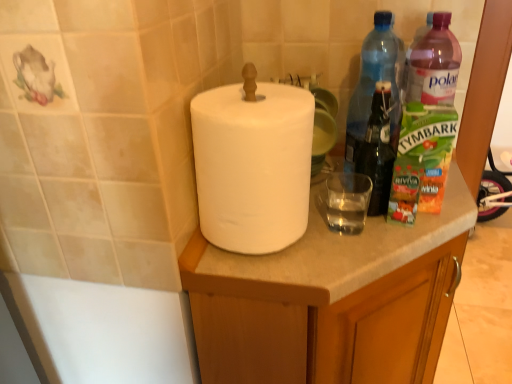
This screenshot has width=512, height=384. Describe the element at coordinates (330, 300) in the screenshot. I see `white matte cabinet at center` at that location.

Image resolution: width=512 pixels, height=384 pixels. What do you see at coordinates (253, 164) in the screenshot?
I see `white matte paper towel at center` at bounding box center [253, 164].

Looking at this image, measure the distance between point [397,55] and camera.

Point [397,55] is 33.43 inches away from camera.

This screenshot has height=384, width=512. Find the location of `white matte cabinet at center`. white matte cabinet at center is located at coordinates (330, 300).

Is transparent plastic bottle at upper right, the second bottle in the right-to-left sequence, next to white matte cabinet at center and touching it?

No, transparent plastic bottle at upper right, the second bottle in the right-to-left sequence, is not touching white matte cabinet at center.

Is transparent plastic bottle at upper right, the second bottle in the right-to-left sequence, positioned with its back to white matte cabinet at center?

No, white matte cabinet at center is not at the back of transparent plastic bottle at upper right, the second bottle in the right-to-left sequence.

Measure the distance from transparent plastic bottle at upper right, the second bottle in the right-to-left sequence, to white matte cabinet at center.

transparent plastic bottle at upper right, the second bottle in the right-to-left sequence, is 8.82 inches from white matte cabinet at center.

Does point (396, 72) appear closer or farther from the camera than point (352, 335)?

Clearly, point (396, 72) is more distant from the camera than point (352, 335).

Is pink plastic bottle at right, which ranks as the 2th bottle in left-to-right order, smaller than transparent plastic bottle at upper right, arranged as the 1th bottle when viewed from the left?

Incorrect, pink plastic bottle at right, which ranks as the 2th bottle in left-to-right order, is not smaller in size than transparent plastic bottle at upper right, arranged as the 1th bottle when viewed from the left.

In the image, is pink plastic bottle at right, which ranks as the 2th bottle in left-to-right order, positioned in front of or behind transparent plastic bottle at upper right, arranged as the 1th bottle when viewed from the left?

Visually, pink plastic bottle at right, which ranks as the 2th bottle in left-to-right order, is located in front of transparent plastic bottle at upper right, arranged as the 1th bottle when viewed from the left.

Can you confirm if pink plastic bottle at right, arranged as the first bottle when viewed from the right, is positioned to the left of transparent plastic bottle at upper right, the second bottle in the right-to-left sequence?

In fact, pink plastic bottle at right, arranged as the first bottle when viewed from the right, is to the right of transparent plastic bottle at upper right, the second bottle in the right-to-left sequence.

In terms of height, does transparent glass at center look taller or shorter compared to pink plastic bottle at right, which ranks as the 2th bottle in left-to-right order?

Considering their sizes, transparent glass at center has less height than pink plastic bottle at right, which ranks as the 2th bottle in left-to-right order.

Would you say transparent glass at center is outside pink plastic bottle at right, arranged as the first bottle when viewed from the right?

Yes, transparent glass at center is outside of pink plastic bottle at right, arranged as the first bottle when viewed from the right.

How many degrees apart are the facing directions of transparent glass at center and pink plastic bottle at right, which ranks as the 2th bottle in left-to-right order?

The facing directions of transparent glass at center and pink plastic bottle at right, which ranks as the 2th bottle in left-to-right order, are 3.01 degrees apart.

Is transparent glass at center placed right next to pink plastic bottle at right, arranged as the first bottle when viewed from the right?

transparent glass at center is not next to pink plastic bottle at right, arranged as the first bottle when viewed from the right, and they're not touching.

Which bottle is the 2nd one when counting from the back of the white matte paper towel at center? Please provide its 2D coordinates.

[(376, 110)]

Between transparent plastic bottle at upper right, arranged as the 1th bottle when viewed from the left, and white matte paper towel at center, which one is positioned in front?

white matte paper towel at center is in front.

Is white matte paper towel at center located within transparent plastic bottle at upper right, the second bottle in the right-to-left sequence?

No, white matte paper towel at center is located outside of transparent plastic bottle at upper right, the second bottle in the right-to-left sequence.

From the image's perspective, does transparent plastic bottle at upper right, arranged as the 1th bottle when viewed from the left, appear higher than white matte paper towel at center?

Yes.

In order to click on cabinetry below the transparent glass at center (from a real-world perspective) in this screenshot , I will do `click(330, 300)`.

Between point (296, 352) and point (346, 207), which one is positioned behind?

Positioned behind is point (346, 207).

How distant is white matte cabinet at center from transparent glass at center?

white matte cabinet at center is 18.63 centimeters away from transparent glass at center.

From a real-world perspective, relative to transparent glass at center, is white matte cabinet at center vertically above or below?

white matte cabinet at center is below transparent glass at center.

Looking at this image, does white matte cabinet at center turn towards pink plastic bottle at right, arranged as the first bottle when viewed from the right?

No.

Is white matte cabinet at center not near pink plastic bottle at right, which ranks as the 2th bottle in left-to-right order?

No, there isn't a large distance between white matte cabinet at center and pink plastic bottle at right, which ranks as the 2th bottle in left-to-right order.

Is point (243, 350) farther from viewer compared to point (451, 129)?

Yes, point (243, 350) is farther from viewer.

Which is more to the right, white matte cabinet at center or pink plastic bottle at right, arranged as the first bottle when viewed from the right?

From the viewer's perspective, pink plastic bottle at right, arranged as the first bottle when viewed from the right, appears more on the right side.

Does white matte paper towel at center turn towards transparent glass at center?

Yes.

Who is smaller, white matte paper towel at center or transparent glass at center?

With smaller size is transparent glass at center.

From the image's perspective, is white matte paper towel at center above or below transparent glass at center?

From the image's perspective, white matte paper towel at center appears above transparent glass at center.

Where is `cabinetry below the transparent plastic bottle at upper right, the second bottle in the right-to-left sequence (from a real-world perspective)`? cabinetry below the transparent plastic bottle at upper right, the second bottle in the right-to-left sequence (from a real-world perspective) is located at coordinates (330, 300).

In order to click on bottle behind the pink plastic bottle at right, arranged as the first bottle when viewed from the right in this screenshot , I will do `click(376, 110)`.

Consider the image. From the image, which object appears to be nearer to transparent glass at center, white matte cabinet at center or pink plastic bottle at right, arranged as the first bottle when viewed from the right?

pink plastic bottle at right, arranged as the first bottle when viewed from the right, is closer to transparent glass at center.

In the scene shown: Based on their spatial positions, is transparent glass at center or white matte cabinet at center closer to transparent plastic bottle at upper right, the second bottle in the right-to-left sequence?

transparent glass at center is closer to transparent plastic bottle at upper right, the second bottle in the right-to-left sequence.

Estimate the real-world distances between objects in this image. Which object is further from white matte cabinet at center, transparent plastic bottle at upper right, the second bottle in the right-to-left sequence, or white matte paper towel at center?

The object further to white matte cabinet at center is transparent plastic bottle at upper right, the second bottle in the right-to-left sequence.

From the image, which object appears to be nearer to transparent glass at center, pink plastic bottle at right, which ranks as the 2th bottle in left-to-right order, or white matte paper towel at center?

The object closer to transparent glass at center is pink plastic bottle at right, which ranks as the 2th bottle in left-to-right order.

Estimate the real-world distances between objects in this image. Which object is closer to white matte cabinet at center, pink plastic bottle at right, arranged as the first bottle when viewed from the right, or transparent glass at center?

transparent glass at center is closer to white matte cabinet at center.

From the image, which object appears to be nearer to white matte cabinet at center, transparent glass at center or white matte paper towel at center?

transparent glass at center is closer to white matte cabinet at center.

Based on the photo, based on their spatial positions, is transparent glass at center or white matte paper towel at center further from pink plastic bottle at right, which ranks as the 2th bottle in left-to-right order?

white matte paper towel at center is further to pink plastic bottle at right, which ranks as the 2th bottle in left-to-right order.

Estimate the real-world distances between objects in this image. Which object is closer to white matte paper towel at center, transparent plastic bottle at upper right, the second bottle in the right-to-left sequence, or white matte cabinet at center?

The object closer to white matte paper towel at center is white matte cabinet at center.

I want to click on paper towel that lies between transparent plastic bottle at upper right, arranged as the 1th bottle when viewed from the left, and white matte cabinet at center from top to bottom, so click(x=253, y=164).

At what (x,y) coordinates should I click in order to perform the action: click on bottle between transparent plastic bottle at upper right, arranged as the 1th bottle when viewed from the left, and white matte cabinet at center vertically. Please return your answer as a coordinate pair (x, y). The height and width of the screenshot is (384, 512). Looking at the image, I should click on (426, 124).

Where is `drinking water between white matte paper towel at center and pink plastic bottle at right, arranged as the first bottle when viewed from the right, in the horizontal direction`? The width and height of the screenshot is (512, 384). drinking water between white matte paper towel at center and pink plastic bottle at right, arranged as the first bottle when viewed from the right, in the horizontal direction is located at coordinates (347, 201).

At what (x,y) coordinates should I click in order to perform the action: click on drinking water between white matte paper towel at center and white matte cabinet at center in the up-down direction. Please return your answer as a coordinate pair (x, y). Looking at the image, I should click on (347, 201).